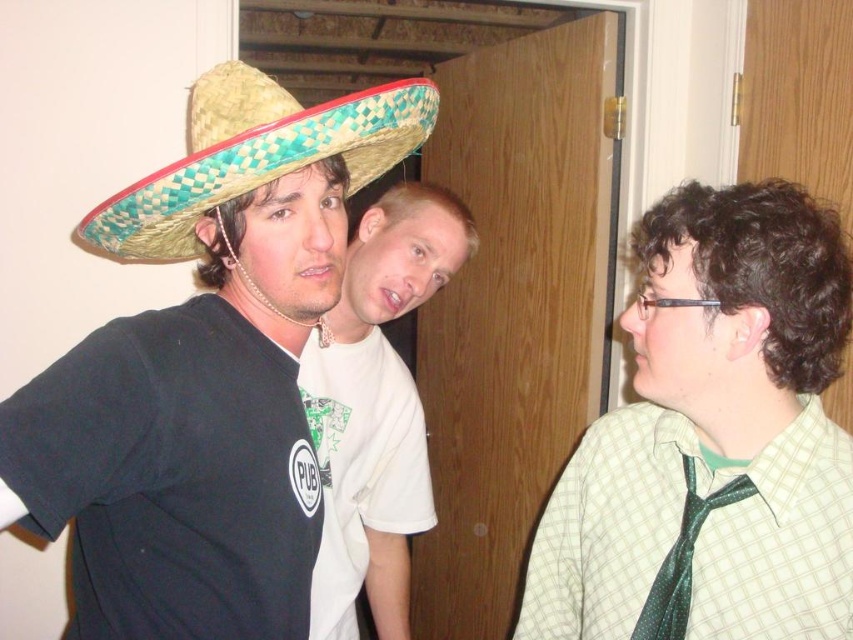
You are standing in a room with three people. You see a woven straw sombrero at left and a green shiny tie at right. Which object is closer to you?

The woven straw sombrero at left is closer to you because it is in front of the green shiny tie at right.